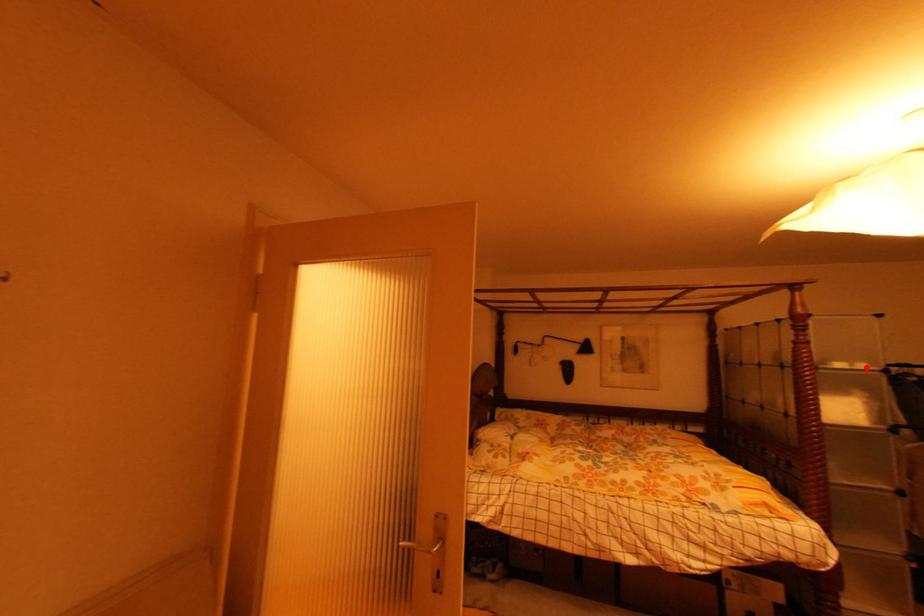
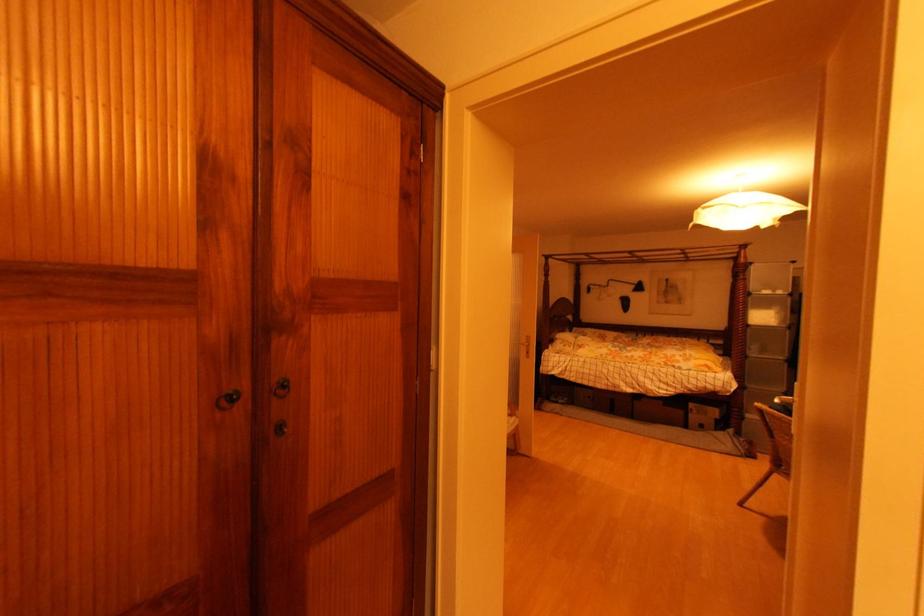
Where in the second image is the point corresponding to the highlighted location from the first image?

(784, 294)